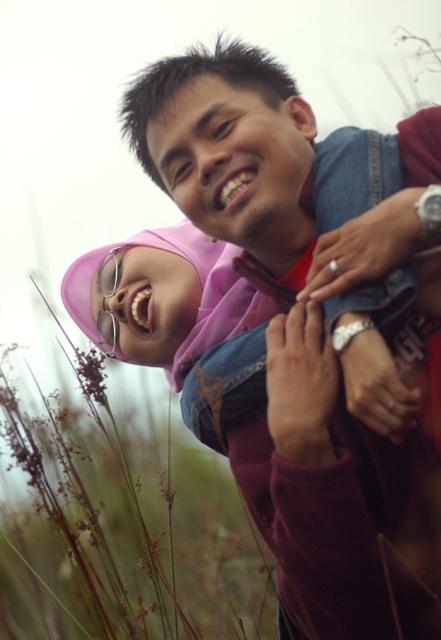
Can you confirm if denim jacket at upper center is bigger than pink satin hijab at upper center?

Yes.

Is denim jacket at upper center further to camera compared to pink satin hijab at upper center?

No, it is not.

Who is more forward, (238, 481) or (112, 333)?

Positioned in front is point (238, 481).

The height and width of the screenshot is (640, 441). Identify the location of denim jacket at upper center. (298, 320).